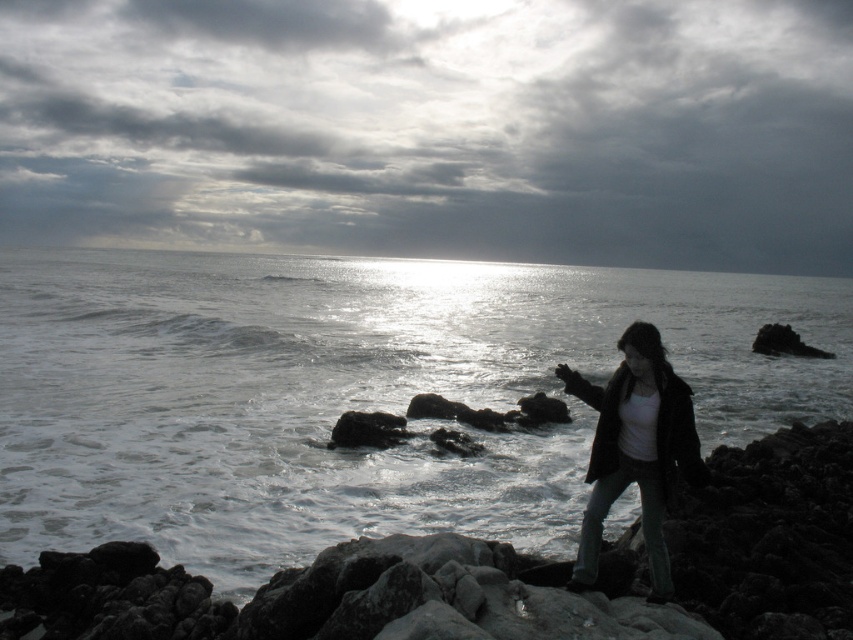
Question: Which point appears closest to the camera in this image?

Choices:
 (A) (593, 474)
 (B) (440, 356)
 (C) (163, 582)
 (D) (415, 193)

Answer: (A)

Question: Is glistening water at center to the right of matte black jacket at lower right from the viewer's perspective?

Choices:
 (A) yes
 (B) no

Answer: (A)

Question: Is glistening water at center to the right of matte black jacket at lower right from the viewer's perspective?

Choices:
 (A) yes
 (B) no

Answer: (A)

Question: Estimate the real-world distances between objects in this image. Which object is closer to the rough textured rocks at lower right?

Choices:
 (A) glistening water at center
 (B) matte black jacket at lower right
 (C) cloudy sky at upper center

Answer: (B)

Question: Which point appears farthest from the camera in this image?

Choices:
 (A) (143, 244)
 (B) (683, 435)

Answer: (A)

Question: Can you confirm if glistening water at center is thinner than rough textured rocks at lower right?

Choices:
 (A) no
 (B) yes

Answer: (A)